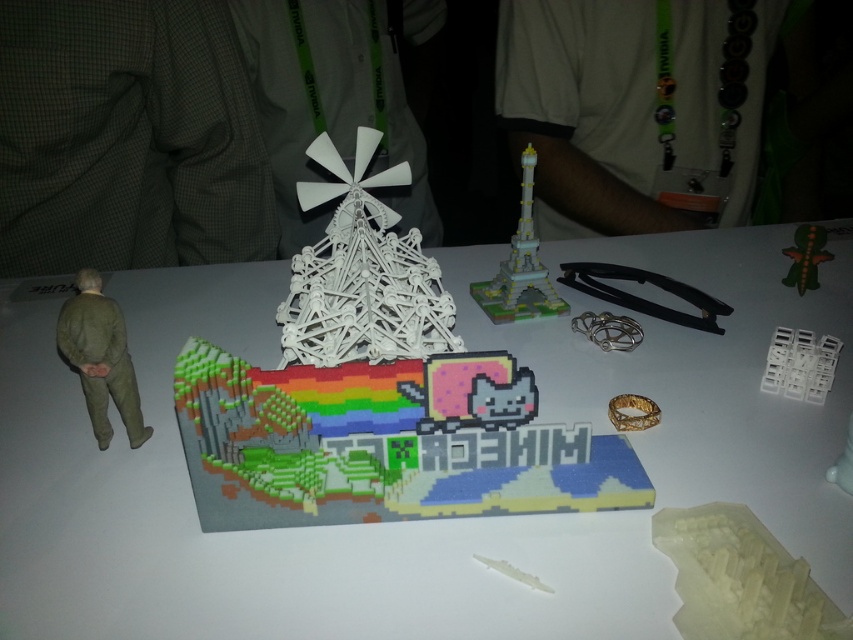
Is matte plastic pixel art at center further to camera compared to green matte figure at left?

No, matte plastic pixel art at center is closer to the viewer.

Is point (461, 291) closer to viewer compared to point (84, 289)?

No, it is behind (84, 289).

The height and width of the screenshot is (640, 853). Find the location of `matte plastic pixel art at center`. matte plastic pixel art at center is located at coordinates (262, 531).